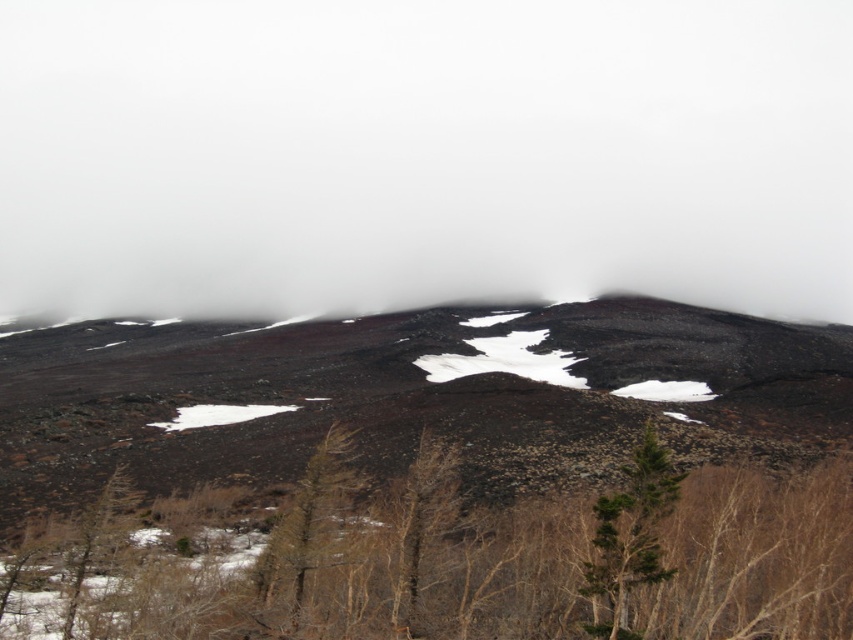
Question: Is white fog at center smaller than brown matte tree at lower center?

Choices:
 (A) yes
 (B) no

Answer: (B)

Question: Among these objects, which one is nearest to the camera?

Choices:
 (A) brown textured tree at center
 (B) dark brown rocky mountain at center
 (C) brown matte tree at lower center

Answer: (A)

Question: Which point appears farthest from the camera in this image?

Choices:
 (A) (323, 536)
 (B) (614, 38)

Answer: (B)

Question: Which point is farther to the camera?

Choices:
 (A) dark brown rocky mountain at center
 (B) green leafy tree at center

Answer: (A)

Question: Is white fog at center above brown textured tree at center?

Choices:
 (A) yes
 (B) no

Answer: (A)

Question: Can you confirm if white fog at center is thinner than brown matte tree at lower center?

Choices:
 (A) no
 (B) yes

Answer: (A)